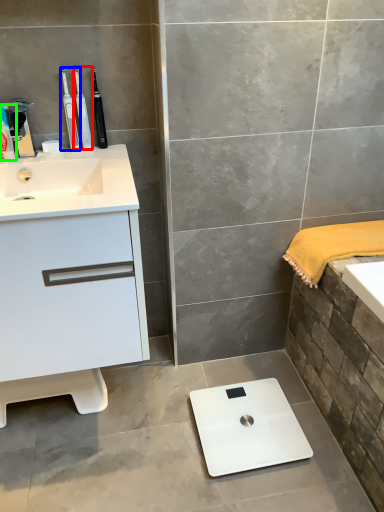
Question: Estimate the real-world distances between objects in this image. Which object is closer to toothbrush (highlighted by a red box), toothbrush (highlighted by a blue box) or toiletry (highlighted by a green box)?

Choices:
 (A) toothbrush
 (B) toiletry

Answer: (A)